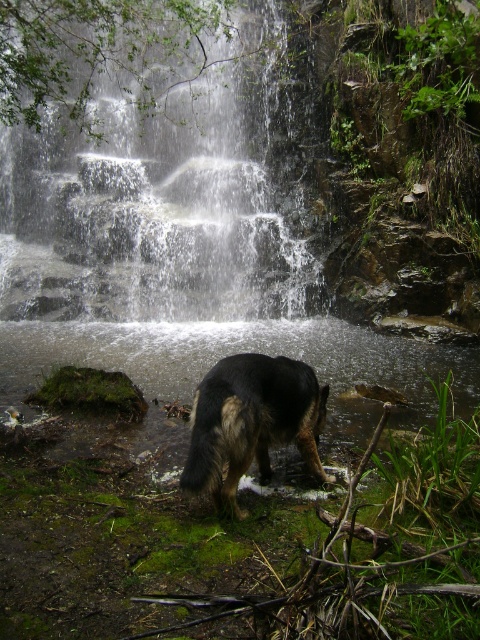
Can you confirm if white textured water at center is thinner than dark brown fur dog at center?

Yes.

Is white textured water at center below dark brown fur dog at center?

Incorrect, white textured water at center is not positioned below dark brown fur dog at center.

Between point (183, 292) and point (261, 424), which one is positioned in front?

Point (261, 424) is more forward.

The image size is (480, 640). Find the location of `white textured water at center`. white textured water at center is located at coordinates (155, 209).